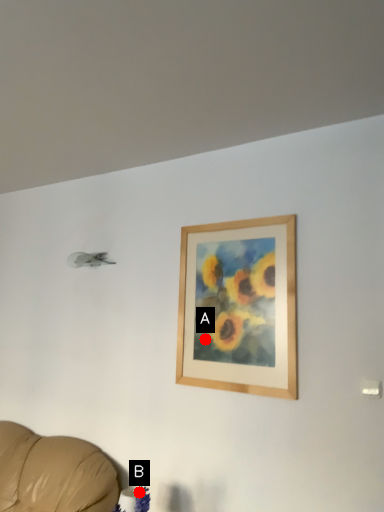
Question: Two points are circled on the image, labeled by A and B beside each circle. Which point is farther to the camera?

Choices:
 (A) A is further
 (B) B is further

Answer: (A)